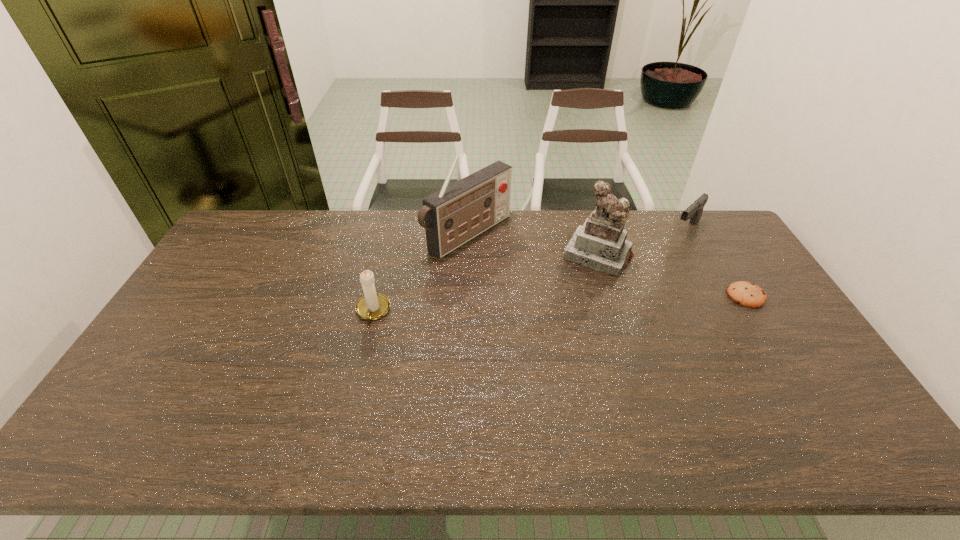
Find the location of a particular element. This screenshot has height=540, width=960. vacant point located between the fourth shortest object and the shortest object is located at coordinates [672, 275].

You are a GUI agent. You are given a task and a screenshot of the screen. Output one action in this format:
    pyautogui.click(x=<x>, y=<y>)
    Task: Click on the vacant space that's between the second object from left to right and the candle holder
    The height and width of the screenshot is (540, 960).
    Given the screenshot: What is the action you would take?
    pyautogui.click(x=420, y=273)

The width and height of the screenshot is (960, 540). I want to click on free point between the pistol and the fourth shortest object, so click(642, 242).

The height and width of the screenshot is (540, 960). In order to click on unoccupied area between the leftmost object and the fourth object from right to left in this screenshot , I will do click(x=420, y=273).

Find the location of a particular element. This screenshot has height=540, width=960. free space between the pistol and the third object from left to right is located at coordinates (642, 242).

This screenshot has height=540, width=960. I want to click on free space between the candle holder and the radio receiver, so click(x=420, y=273).

Find the location of a particular element. The width and height of the screenshot is (960, 540). object that is the third closest to the shortest object is located at coordinates (457, 213).

In order to click on object that can be found as the second closest to the fourth tallest object in this screenshot , I will do `click(747, 294)`.

Find the location of `vacant space that satisfies the following two spatial constraints: 1. on the front side of the radio receiver; 2. on the right side of the fourth shortest object`. vacant space that satisfies the following two spatial constraints: 1. on the front side of the radio receiver; 2. on the right side of the fourth shortest object is located at coordinates tap(468, 255).

This screenshot has width=960, height=540. Find the location of `vacant space that satisfies the following two spatial constraints: 1. on the back side of the pistol; 2. on the left side of the figurine`. vacant space that satisfies the following two spatial constraints: 1. on the back side of the pistol; 2. on the left side of the figurine is located at coordinates (590, 229).